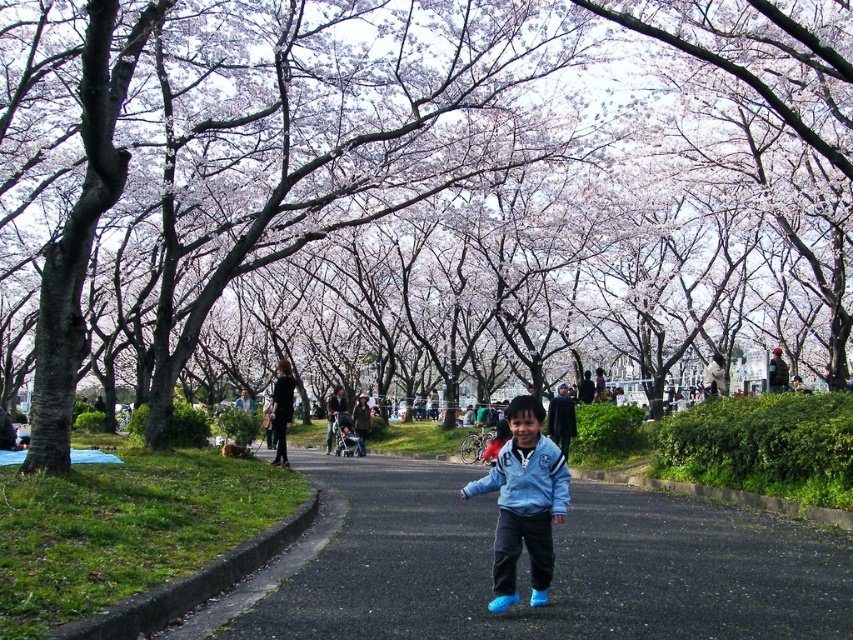
Question: Considering the real-world distances, which object is closest to the smooth bark tree at center?

Choices:
 (A) blue matte jacket at center
 (B) black asphalt road at center
 (C) blue fabric jacket at center

Answer: (B)

Question: Does black asphalt road at center appear under blue matte jacket at center?

Choices:
 (A) no
 (B) yes

Answer: (B)

Question: Does smooth bark tree at center have a larger size compared to black asphalt road at center?

Choices:
 (A) yes
 (B) no

Answer: (A)

Question: Among these points, which one is nearest to the camera?

Choices:
 (A) (566, 477)
 (B) (527, 520)

Answer: (B)

Question: Based on their relative distances, which object is farther from the smooth bark tree at center?

Choices:
 (A) blue fabric jacket at center
 (B) black asphalt road at center

Answer: (A)

Question: Can you confirm if smooth bark tree at center is positioned above black asphalt road at center?

Choices:
 (A) yes
 (B) no

Answer: (A)